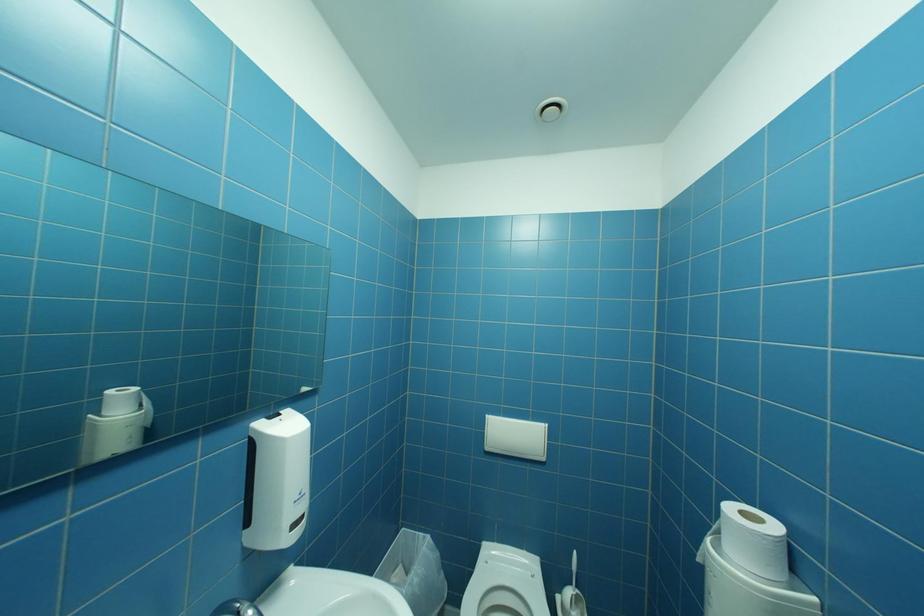
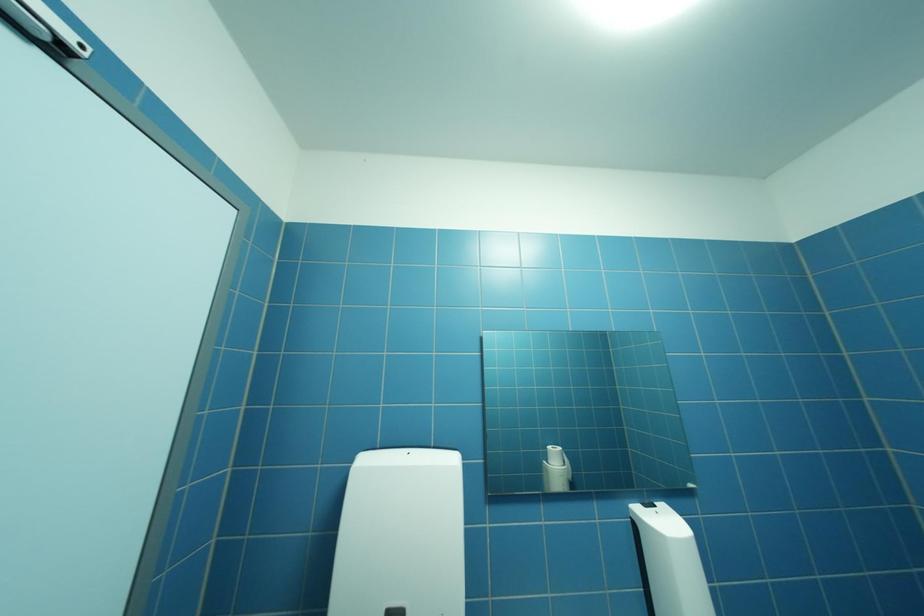
First-person continuous shooting, in which direction is the camera rotating?

The camera's rotation is toward left-up.